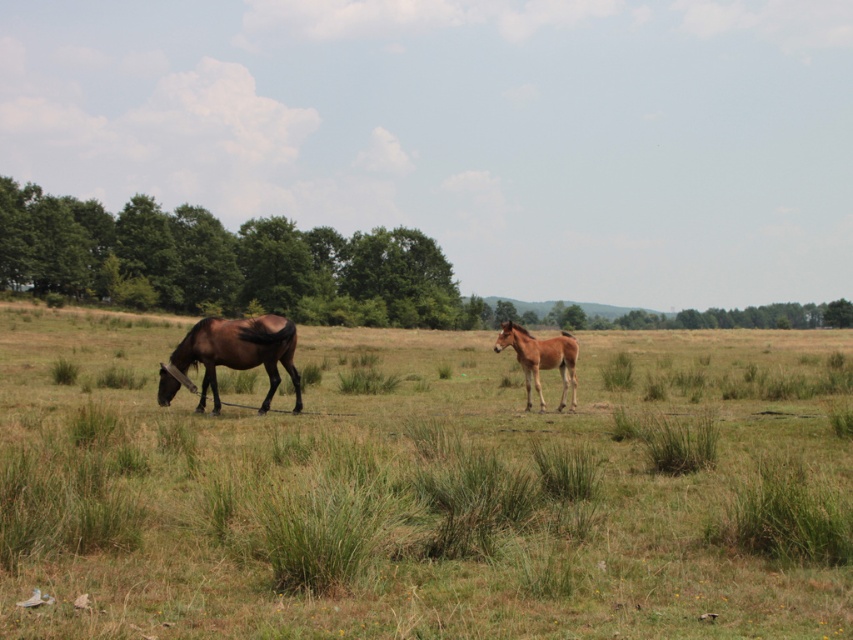
Question: Can you confirm if green leafy trees at left is positioned above brown glossy horse at center?

Choices:
 (A) no
 (B) yes

Answer: (B)

Question: Which point is closer to the camera taking this photo?

Choices:
 (A) (184, 358)
 (B) (527, 340)
 (C) (442, 314)
 (D) (757, 400)

Answer: (A)

Question: Considering the relative positions of brown glossy horse at left and brown glossy horse at center in the image provided, where is brown glossy horse at left located with respect to brown glossy horse at center?

Choices:
 (A) below
 (B) above

Answer: (A)

Question: Among these objects, which one is nearest to the camera?

Choices:
 (A) brown grassland at center
 (B) green leafy trees at left
 (C) brown glossy horse at center

Answer: (A)

Question: Which point is farther to the camera?

Choices:
 (A) brown glossy horse at center
 (B) brown glossy horse at left
 (C) brown grassland at center

Answer: (A)

Question: Can you confirm if brown grassland at center is bigger than brown glossy horse at center?

Choices:
 (A) no
 (B) yes

Answer: (B)